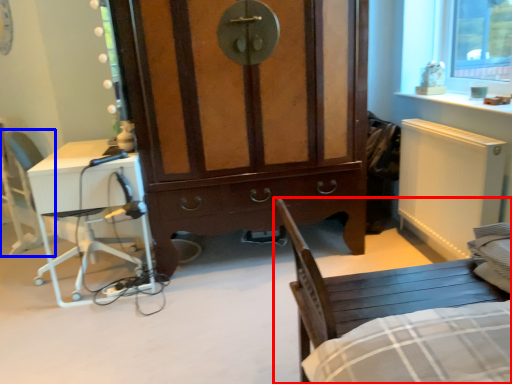
Question: Which point is closer to the camera, chair (highlighted by a red box) or armchair (highlighted by a blue box)?

Choices:
 (A) chair
 (B) armchair

Answer: (A)